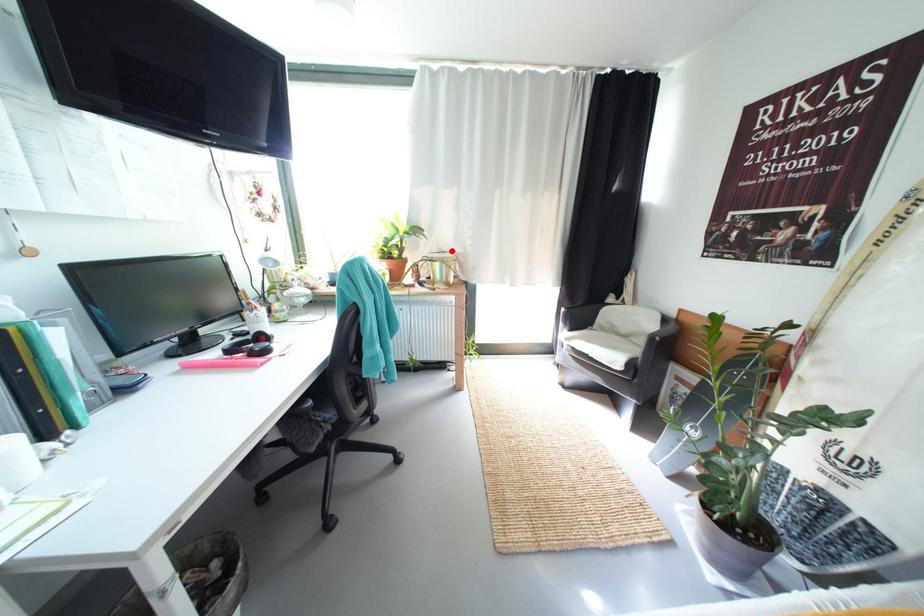
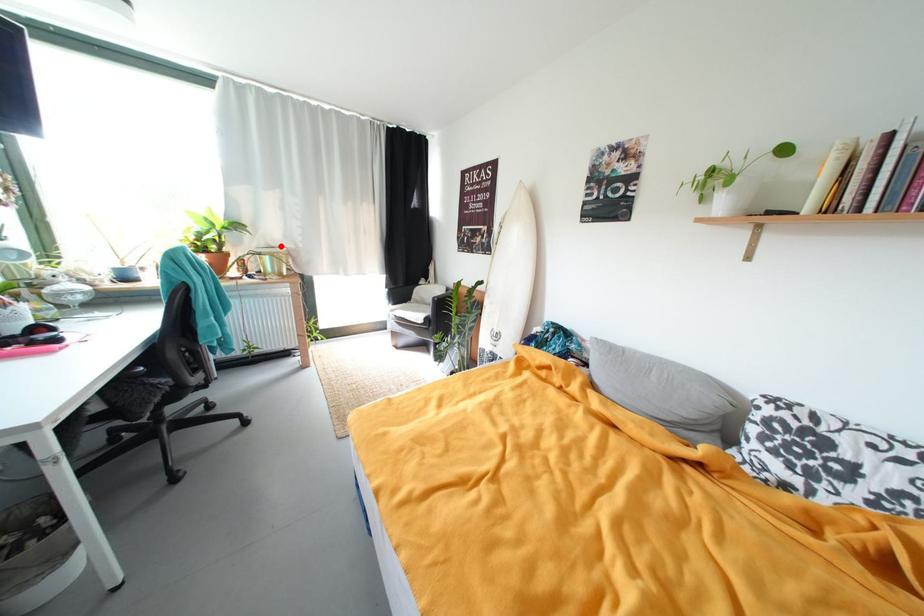
I am providing you with two images of the same scene from different viewpoints. A red point is marked on the first image and another point is marked on the second image. Is the marked point in image1 the same physical position as the marked point in image2?

Yes